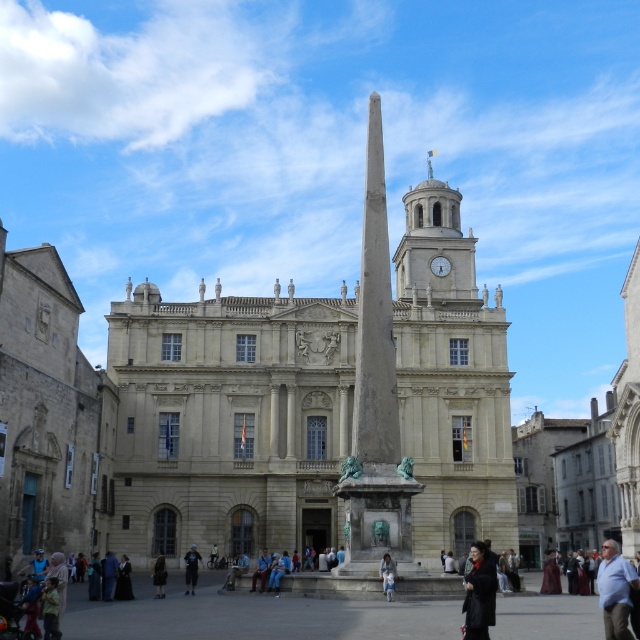
Question: Which point is farther to the camera?

Choices:
 (A) dark blue jeans at center
 (B) gray stone obelisk at center
 (C) smooth stone clock tower at center
 (D) light blue shirt at lower right

Answer: (C)

Question: Which of these objects is positioned closest to the dark blue jeans at center?

Choices:
 (A) smooth stone clock tower at center
 (B) blue denim jeans at center
 (C) gray stone obelisk at center
 (D) dark gray fabric coat at center

Answer: (D)

Question: Where is smooth stone clock tower at center located in relation to light blue shirt at lower right in the image?

Choices:
 (A) below
 (B) above

Answer: (B)

Question: Observing the image, what is the correct spatial positioning of light blue shirt at lower right in reference to dark blue jeans at center?

Choices:
 (A) below
 (B) above

Answer: (B)

Question: Does gray stone obelisk at center appear on the right side of light blue shirt at lower right?

Choices:
 (A) no
 (B) yes

Answer: (A)

Question: Which object is the closest to the gray stone obelisk at center?

Choices:
 (A) smooth stone clock tower at center
 (B) dark blue jeans at center
 (C) blue denim jeans at center
 (D) light blue shirt at lower right

Answer: (C)